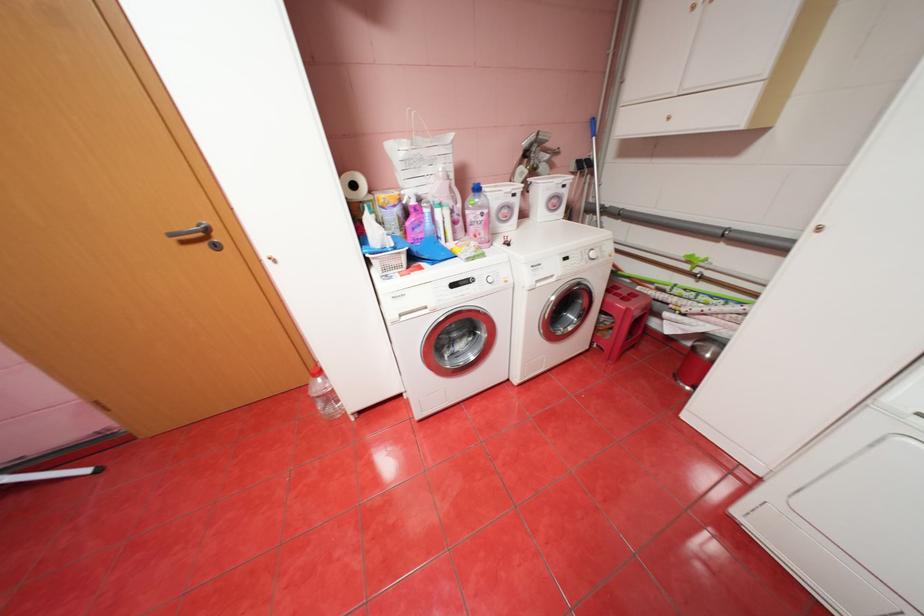
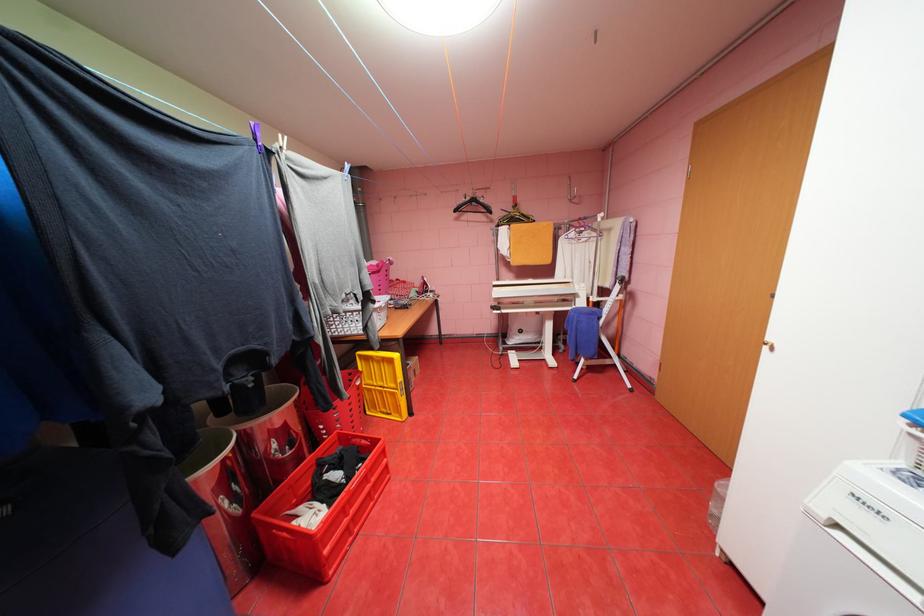
Locate, in the second image, the point that corresponds to (276,262) in the first image.

(774, 347)